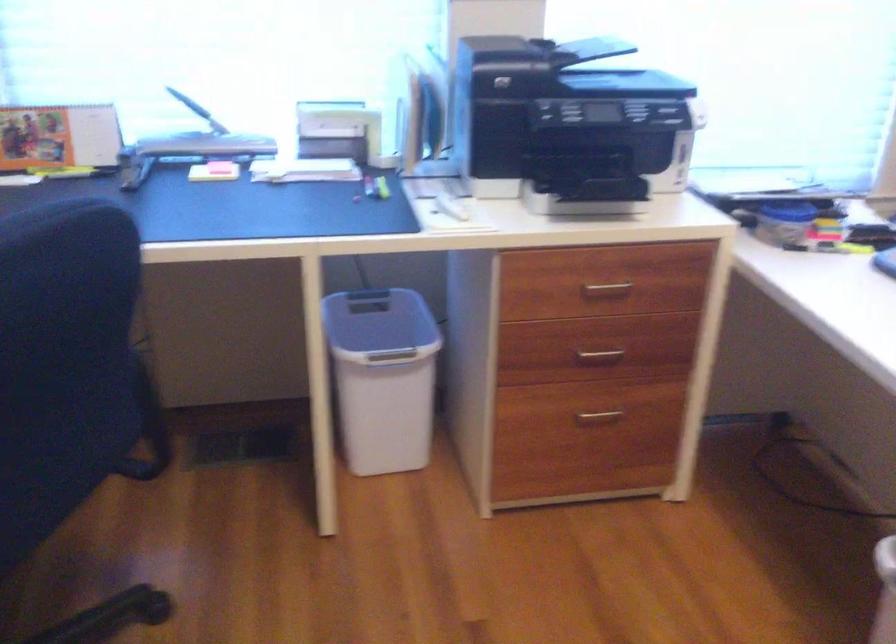
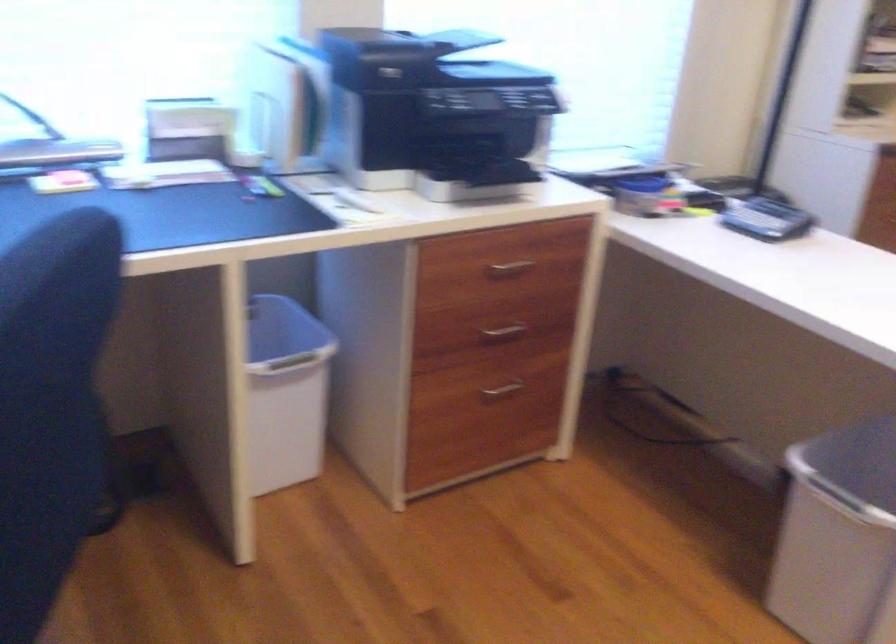
Locate, in the second image, the point that corresponds to point 600,354 in the first image.

(503, 330)